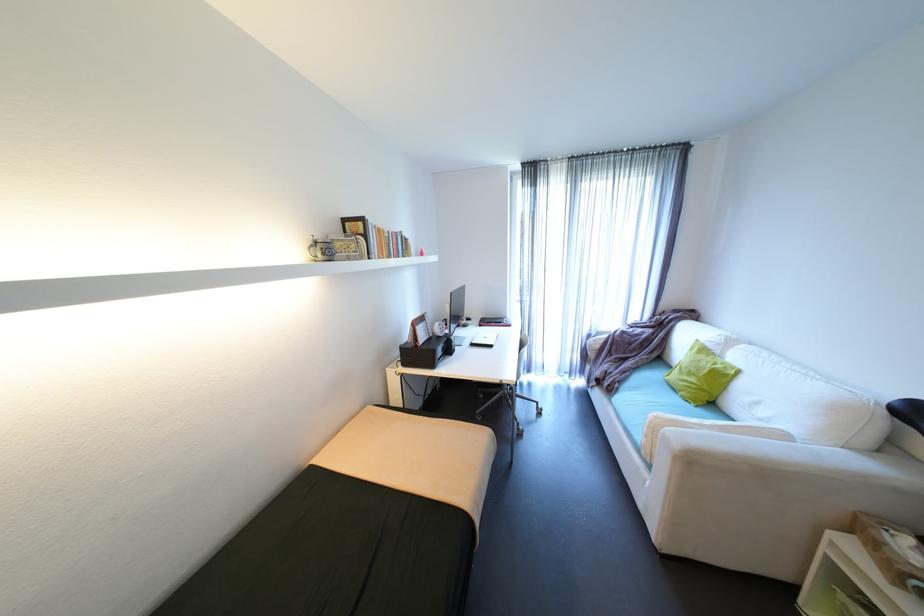
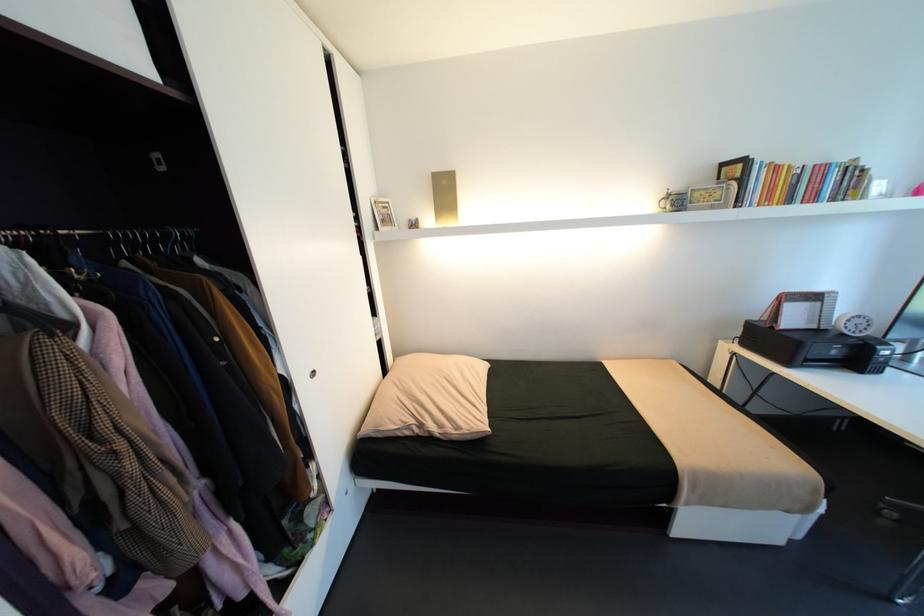
The point at [423,346] is marked in the first image. Where is the corresponding point in the second image?

(779, 328)